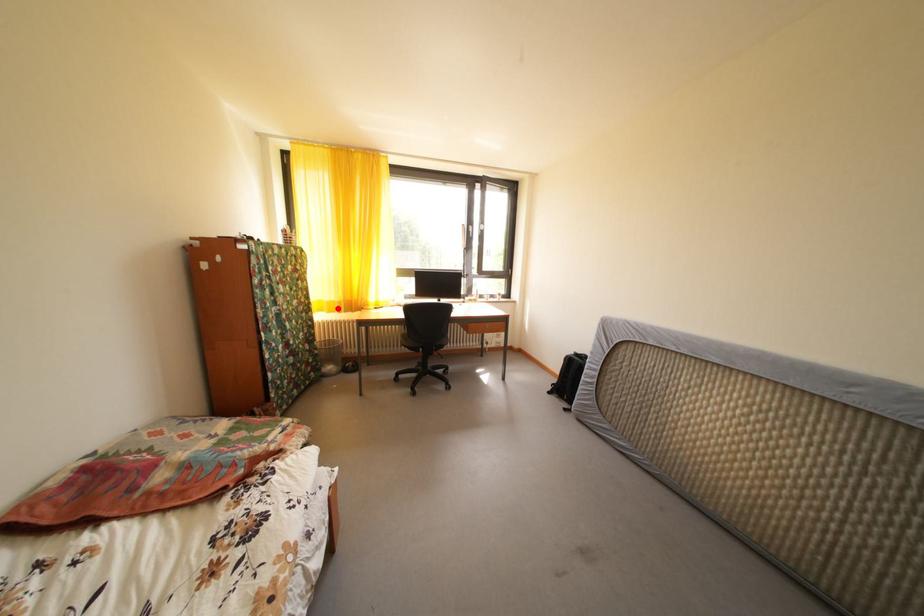
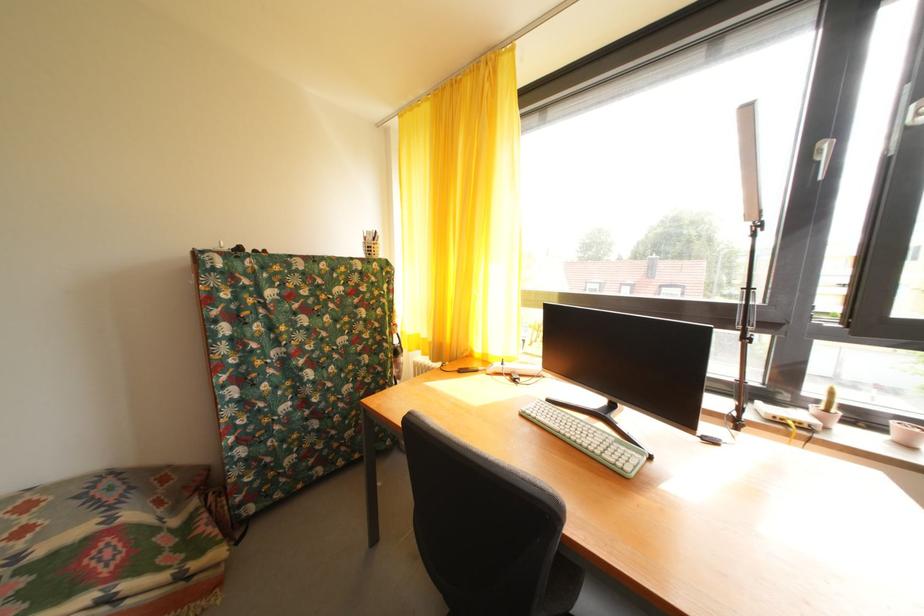
Question: I am providing you with two images of the same scene from different viewpoints. A red point is marked on the first image. Can you still see the location of the red point in image 2?

Choices:
 (A) Yes
 (B) No

Answer: (A)